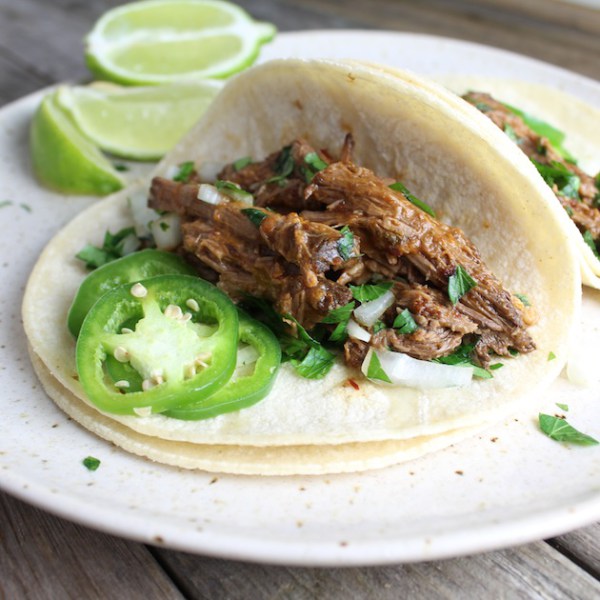
Image resolution: width=600 pixels, height=600 pixels. In order to click on white plate in this screenshot , I will do `click(463, 482)`, `click(257, 510)`, `click(68, 451)`.